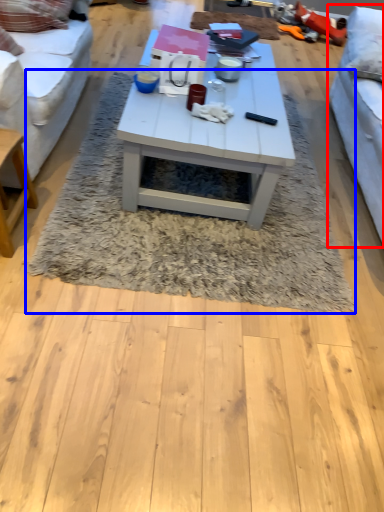
Question: Which of the following is the farthest to the observer, studio couch (highlighted by a red box) or mat (highlighted by a blue box)?

Choices:
 (A) studio couch
 (B) mat

Answer: (B)